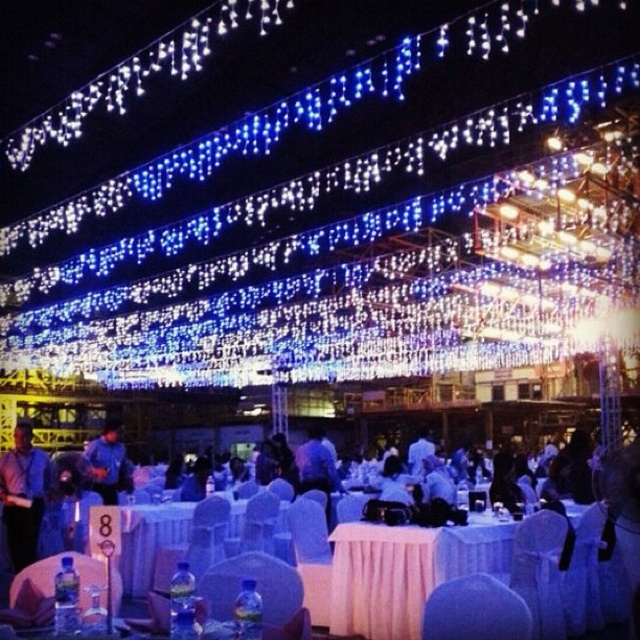
You are at the event and want to find the person wearing the dark blue shirt at left. According to the coordinates provided, where would you look relative to your current position?

You should look towards the lower left area since the dark blue shirt at left is located at point 0.773 on the x axis and 0.036 on the y axis, which corresponds to the lower left section of the image.

You are at the event and want to greet both the person wearing the dark blue shirt at left and the person in the white fabric shirt at center. Which person should you approach first if you want to greet the one closer to you first?

You should approach the dark blue shirt at left first because it is closer to you than the white fabric shirt at center.

You are a photographer at the event and need to capture a photo of both the dark blue shirt at left and the blue fabric shirt at center. Which shirt should you focus on first to ensure both are in frame?

The dark blue shirt at left is not as tall as the blue fabric shirt at center, so you should focus on the blue fabric shirt at center first to ensure both are in frame.